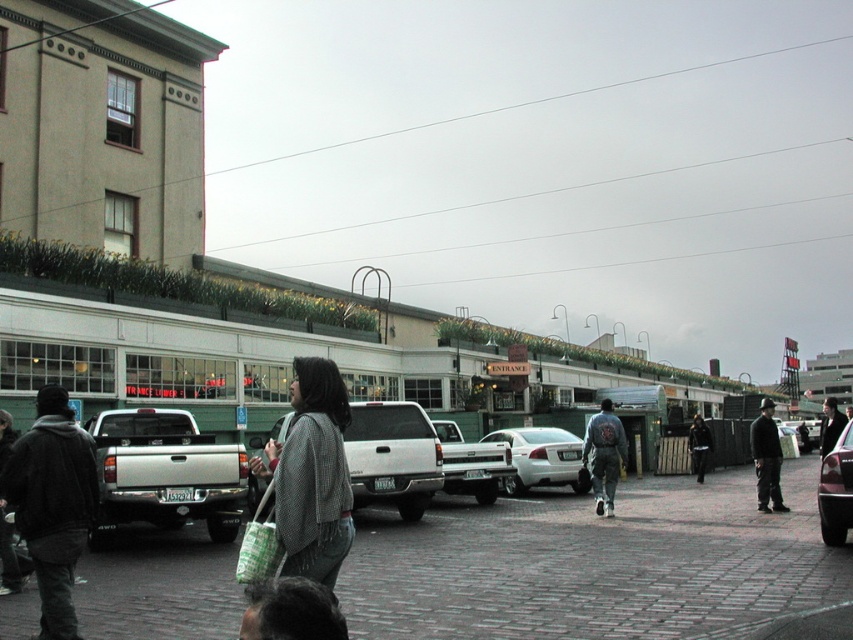
You are standing at the point with coordinates point (97, 540) and want to walk to the point with coordinates point (583, 486). Will you pass in front of any objects along the way?

Since point (97, 540) is in front of point (583, 486), you will be moving away from the point (583, 486) and thus won t pass in front of any objects along the way.

You are a delivery driver who needs to park your vehicle between the silver metallic pickup truck at lower left and the matte white pickup truck at center. Given that your delivery van is 2 meters wide, can you fit your van in the space between them?

The silver metallic pickup truck at lower left is wider than the matte white pickup truck at center, so the space between them may not be sufficient for a 2 meter wide van. The exact width isn not provided, so it is uncertain.

You are standing at the starting point in the urban street scene. There are two points marked as point 1 at coordinates [148,448] and point 2 at coordinates [409,513]. Which point is closer to you?

Point 1 at coordinates [148,448] is closer to you because it is in front of point 2 at coordinates [409,513].